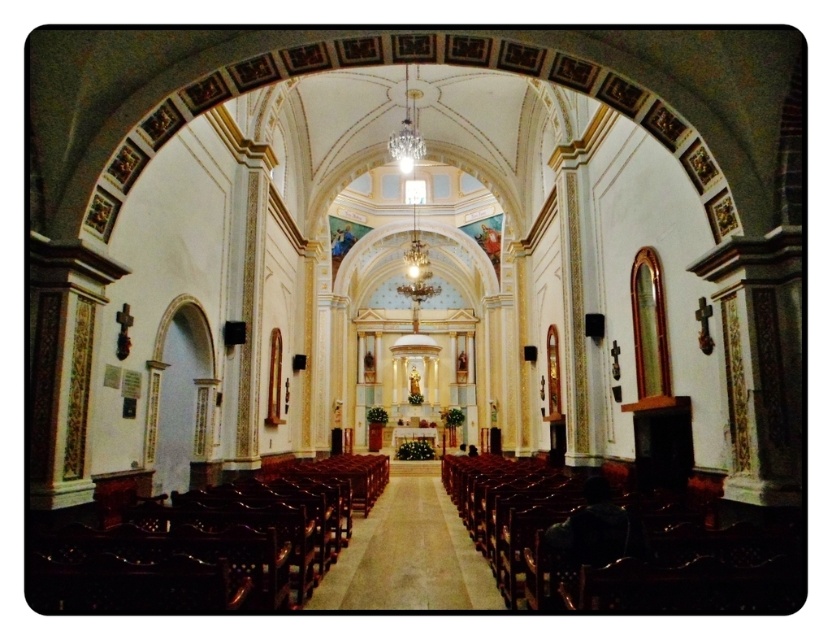
Who is more distant from viewer, (121, 602) or (439, 547)?

The point (439, 547) is behind.

Is point (110, 568) less distant than point (418, 484)?

Yes, it is in front of point (418, 484).

The width and height of the screenshot is (832, 640). Identify the location of polished dark wood chairs at left. (208, 541).

In the scene shown: Is polished dark wood chairs at left to the left of mahogany polished wood chair at lower right from the viewer's perspective?

Indeed, polished dark wood chairs at left is positioned on the left side of mahogany polished wood chair at lower right.

Which of these two, polished dark wood chairs at left or mahogany polished wood chair at lower right, stands taller?

polished dark wood chairs at left

Which is in front, point (172, 556) or point (771, 604)?

Point (771, 604)

I want to click on polished dark wood chairs at left, so click(208, 541).

Does mahogany polished wood chair at lower right lie behind wooden polished aisle at center?

Result: No, it is not.

Between mahogany polished wood chair at lower right and wooden polished aisle at center, which one is positioned lower?

wooden polished aisle at center

I want to click on mahogany polished wood chair at lower right, so click(613, 545).